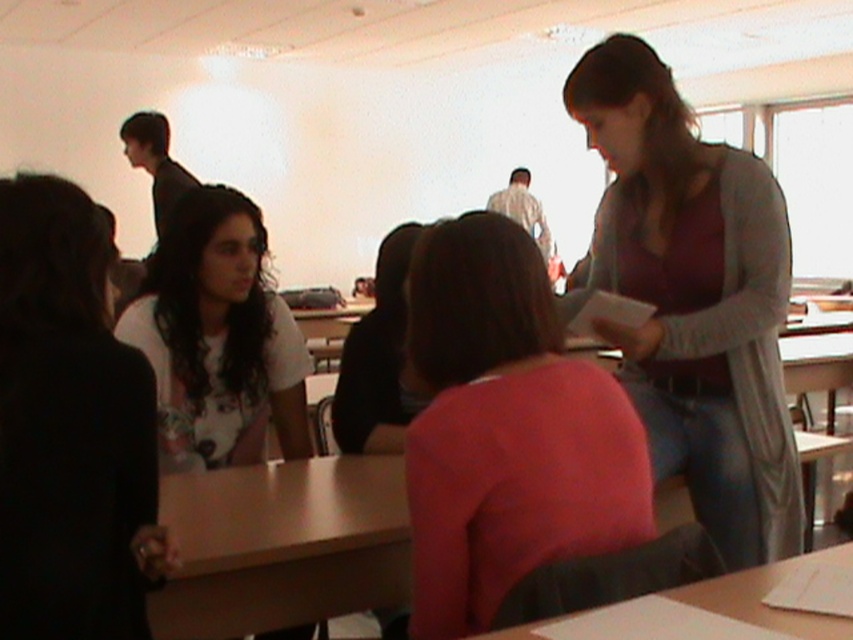
The height and width of the screenshot is (640, 853). What do you see at coordinates (218, 339) in the screenshot?
I see `white matte shirt at left` at bounding box center [218, 339].

Can you confirm if white matte shirt at left is positioned above dark brown hair at upper left?

No.

Does point (253, 420) come behind point (122, 122)?

No, it is in front of (122, 122).

Find the location of `white matte shirt at left`. white matte shirt at left is located at coordinates (218, 339).

Who is more distant from viewer, (746, 317) or (155, 307)?

The point (155, 307) is more distant.

Locate an element on the screen. This screenshot has height=640, width=853. gray sweater at right is located at coordinates (694, 298).

Does pink matte shirt at center have a lesser height compared to dark brown hair at upper left?

In fact, pink matte shirt at center may be taller than dark brown hair at upper left.

Can you confirm if pink matte shirt at center is positioned to the left of dark brown hair at upper left?

Incorrect, pink matte shirt at center is not on the left side of dark brown hair at upper left.

Find the location of a particular element. pink matte shirt at center is located at coordinates (506, 429).